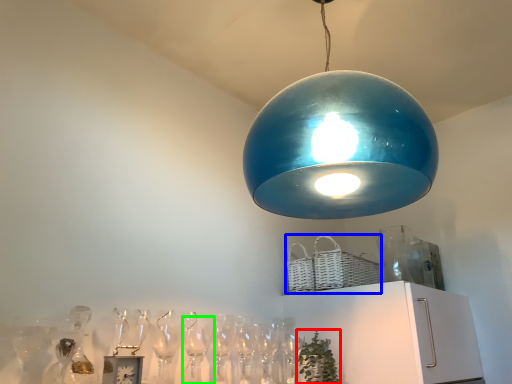
Question: Considering the real-world distances, which object is closest to plant (highlighted by a red box)? basket (highlighted by a blue box) or wine glass (highlighted by a green box).

Choices:
 (A) basket
 (B) wine glass

Answer: (A)